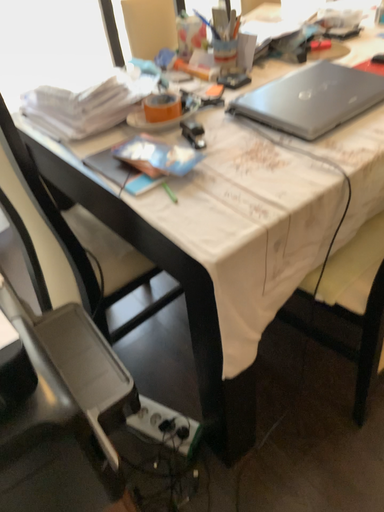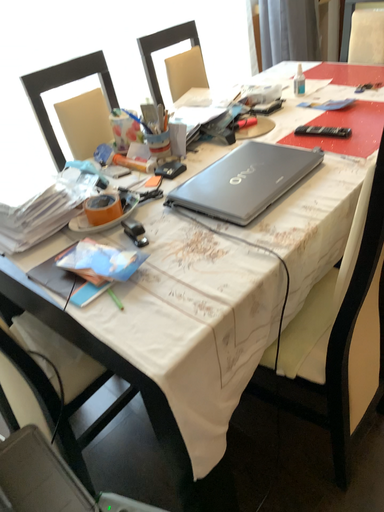
Question: Which way did the camera rotate in the video?

Choices:
 (A) rotated upward
 (B) rotated downward

Answer: (A)